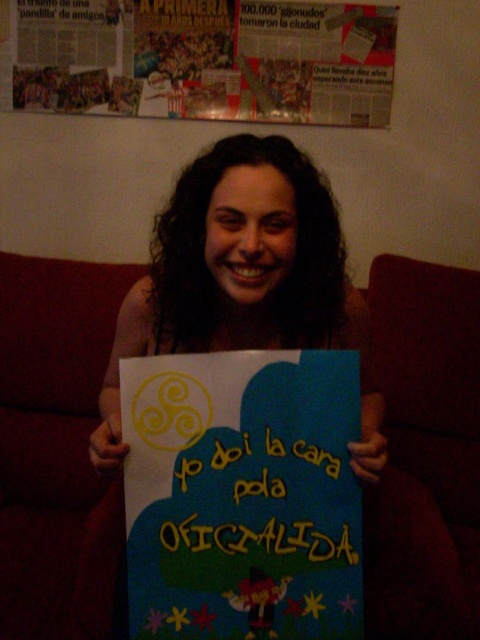
Question: Which object is closer to the camera taking this photo?

Choices:
 (A) blue paper poster at center
 (B) matte paper poster at upper center
 (C) red fabric couch at center

Answer: (A)

Question: Observing the image, what is the correct spatial positioning of blue paper poster at center in reference to matte paper poster at upper center?

Choices:
 (A) right
 (B) left

Answer: (A)

Question: In this image, where is red fabric couch at center located relative to matte paper poster at upper center?

Choices:
 (A) left
 (B) right

Answer: (A)

Question: Does red fabric couch at center have a smaller size compared to blue paper poster at center?

Choices:
 (A) yes
 (B) no

Answer: (B)

Question: Estimate the real-world distances between objects in this image. Which object is closer to the red fabric couch at center?

Choices:
 (A) matte paper poster at upper center
 (B) blue paper poster at center

Answer: (B)

Question: Estimate the real-world distances between objects in this image. Which object is closer to the red fabric couch at center?

Choices:
 (A) blue paper poster at center
 (B) matte paper poster at upper center

Answer: (A)